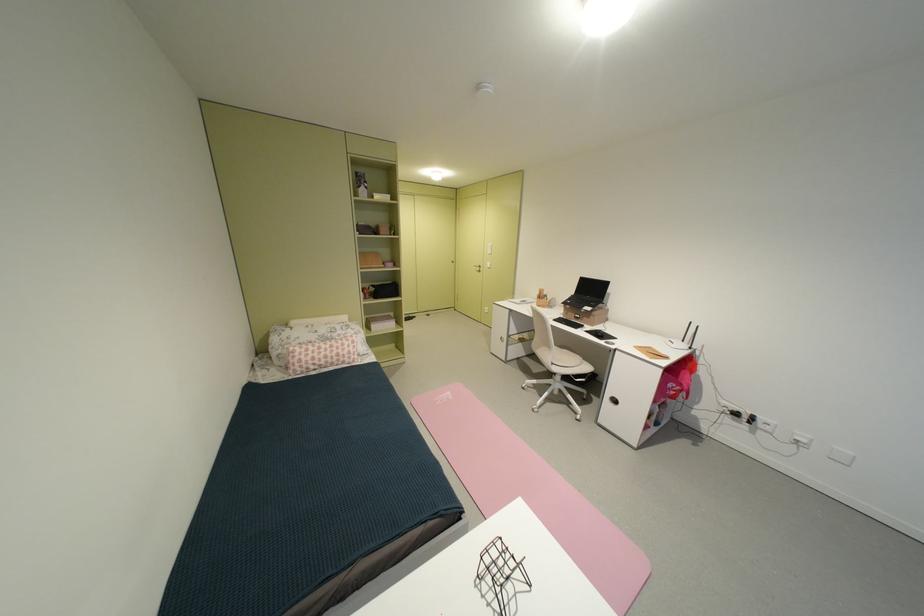
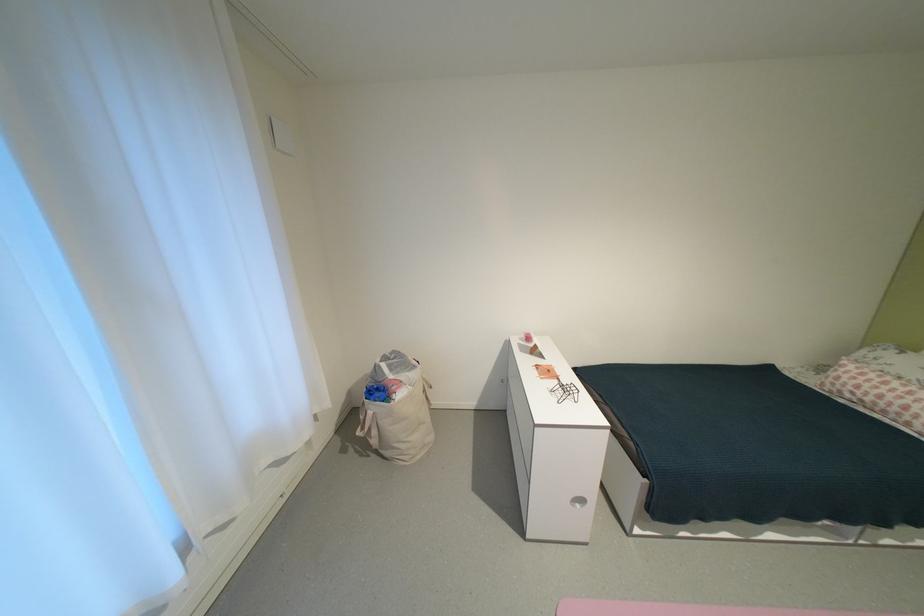
Where in the second image is the point corresponding to [324,363] from the first image?

(867, 392)